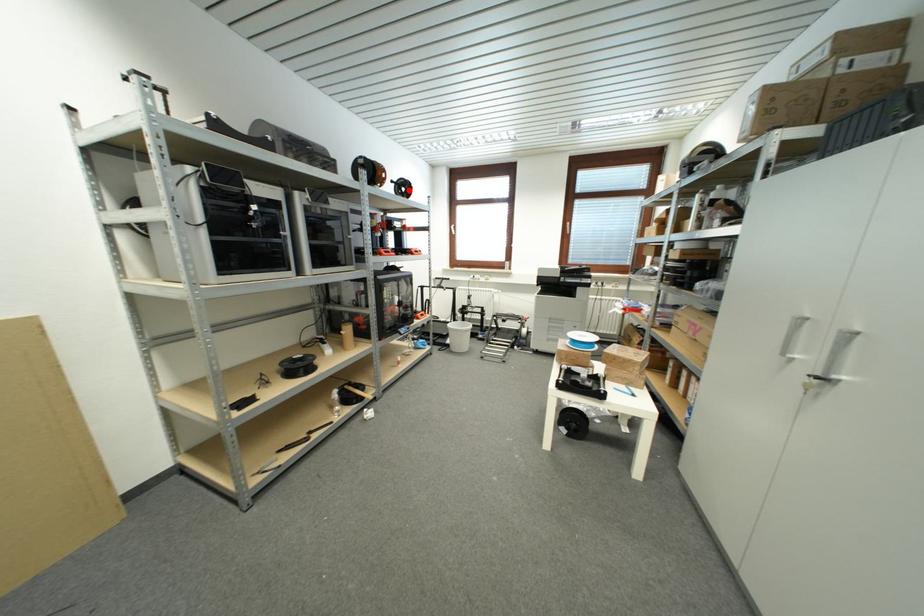
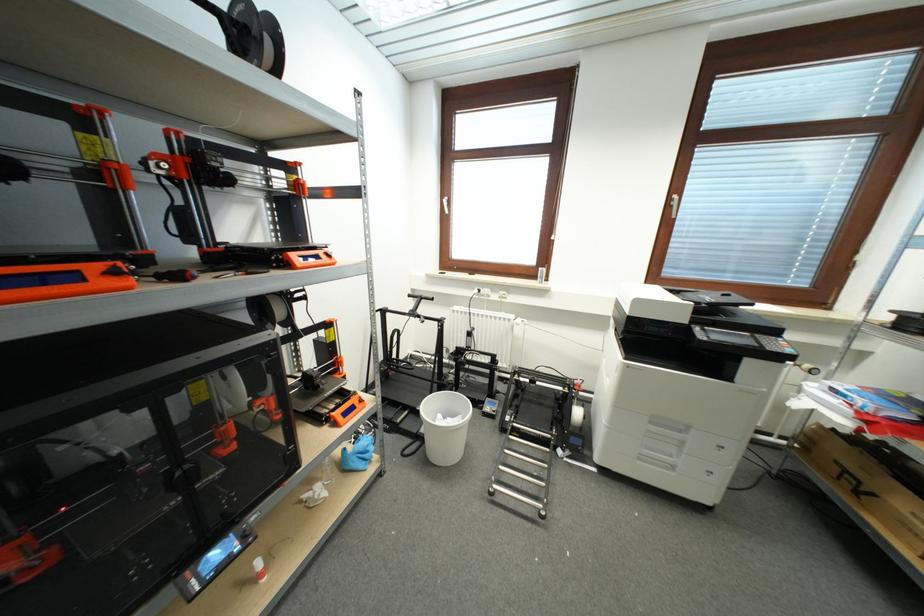
Where in the second image is the point corresponding to the highlighted location from the first image?

(260, 39)